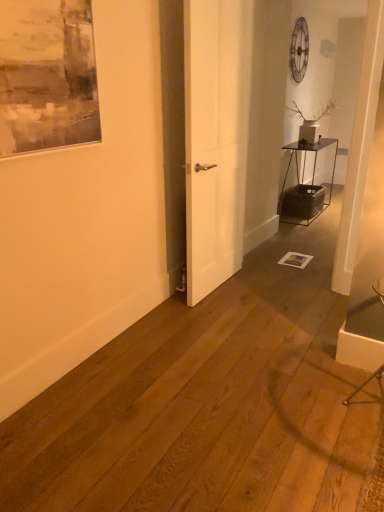
Question: Is metallic black table at right oriented away from matte gray painting at upper left?

Choices:
 (A) yes
 (B) no

Answer: (B)

Question: Does metallic black table at right have a smaller size compared to matte gray painting at upper left?

Choices:
 (A) yes
 (B) no

Answer: (B)

Question: Is metallic black table at right located outside matte gray painting at upper left?

Choices:
 (A) no
 (B) yes

Answer: (B)

Question: Is metallic black table at right shorter than matte gray painting at upper left?

Choices:
 (A) no
 (B) yes

Answer: (A)

Question: Can you confirm if metallic black table at right is wider than matte gray painting at upper left?

Choices:
 (A) yes
 (B) no

Answer: (A)

Question: Is metallic black table at right spatially inside matte gray painting at upper left, or outside of it?

Choices:
 (A) outside
 (B) inside

Answer: (A)

Question: Considering their positions, is metallic black table at right located in front of or behind matte gray painting at upper left?

Choices:
 (A) front
 (B) behind

Answer: (B)

Question: From the image's perspective, relative to matte gray painting at upper left, is metallic black table at right above or below?

Choices:
 (A) above
 (B) below

Answer: (A)

Question: From a real-world perspective, is metallic black table at right physically located above or below matte gray painting at upper left?

Choices:
 (A) below
 (B) above

Answer: (A)

Question: Considering their positions, is metallic black table at right located in front of or behind metallic silver armchair at lower right?

Choices:
 (A) front
 (B) behind

Answer: (B)

Question: Is point (x=304, y=207) closer or farther from the camera than point (x=382, y=302)?

Choices:
 (A) closer
 (B) farther

Answer: (B)

Question: Is metallic black table at right inside or outside of metallic silver armchair at lower right?

Choices:
 (A) outside
 (B) inside

Answer: (A)

Question: From the image's perspective, is metallic black table at right above or below metallic silver armchair at lower right?

Choices:
 (A) above
 (B) below

Answer: (A)

Question: From a real-world perspective, is white matte door at center physically located above or below matte gray painting at upper left?

Choices:
 (A) below
 (B) above

Answer: (A)

Question: Looking at their shapes, would you say white matte door at center is wider or thinner than matte gray painting at upper left?

Choices:
 (A) wide
 (B) thin

Answer: (A)